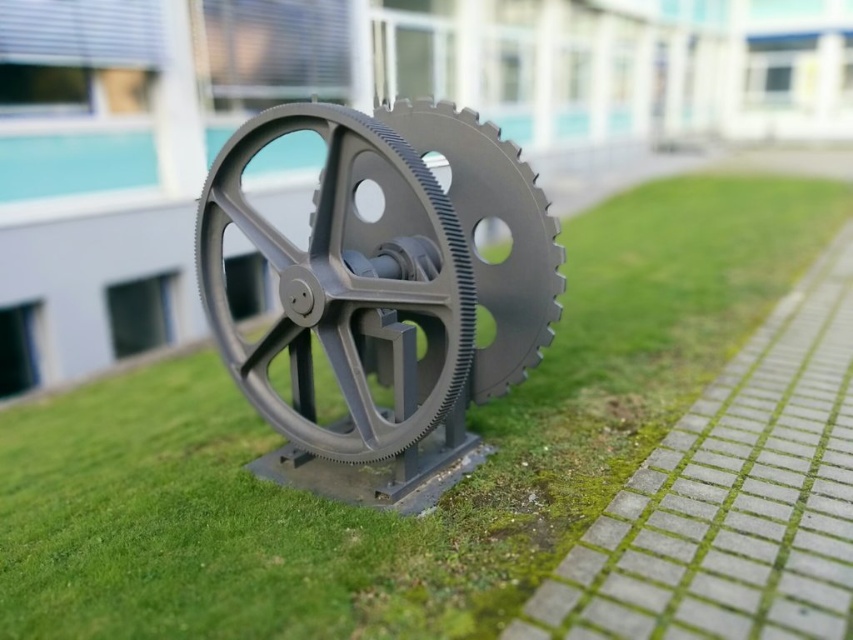
Who is taller, gray concrete paving at lower right or matte gray gear at center?

With more height is gray concrete paving at lower right.

Is point (636, 472) positioned in front of point (215, 184)?

Yes.

Image resolution: width=853 pixels, height=640 pixels. I want to click on gray concrete paving at lower right, so click(x=732, y=497).

Which of these two, gray concrete paving at lower right or gray matte gear at center, stands shorter?

gray matte gear at center is shorter.

Find the location of a particular element. gray concrete paving at lower right is located at coordinates click(x=732, y=497).

You are a GUI agent. You are given a task and a screenshot of the screen. Output one action in this format:
    pyautogui.click(x=<x>, y=<y>)
    Task: Click on the gray concrete paving at lower right
    
    Given the screenshot: What is the action you would take?
    pyautogui.click(x=732, y=497)

Find the location of a particular element. Image resolution: width=853 pixels, height=640 pixels. gray concrete paving at lower right is located at coordinates (732, 497).

Which is more to the left, green matte grass at center or gray concrete paving at lower right?

From the viewer's perspective, green matte grass at center appears more on the left side.

Find the location of a particular element. This screenshot has height=640, width=853. green matte grass at center is located at coordinates click(372, 509).

Does point (770, 266) lie behind point (805, 625)?

Yes.

You are a GUI agent. You are given a task and a screenshot of the screen. Output one action in this format:
    pyautogui.click(x=<x>, y=<y>)
    Task: Click on the green matte grass at center
    
    Given the screenshot: What is the action you would take?
    pyautogui.click(x=372, y=509)